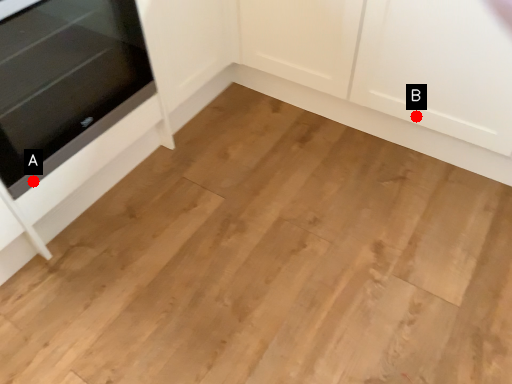
Question: Two points are circled on the image, labeled by A and B beside each circle. Which point is further to the camera?

Choices:
 (A) A is further
 (B) B is further

Answer: (B)